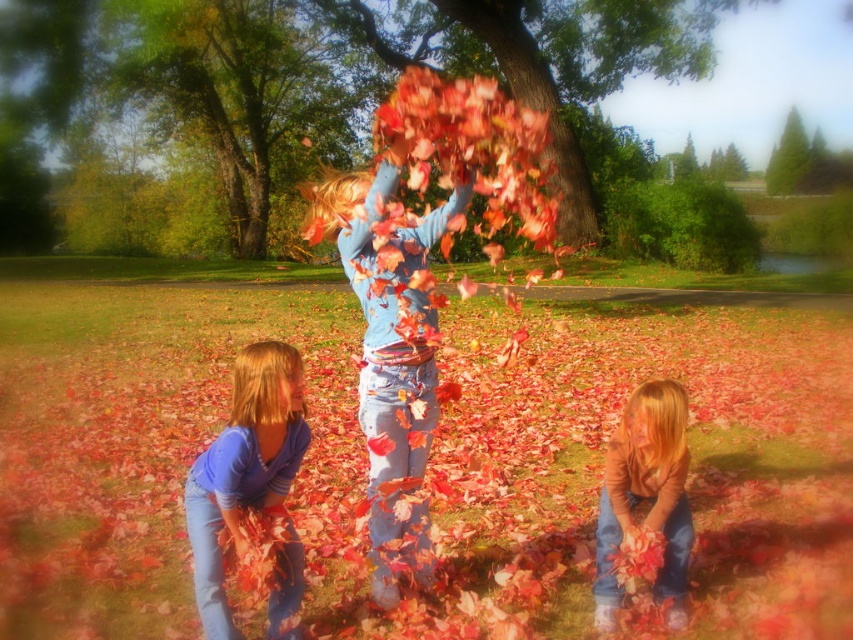
You are a photographer trying to capture the autumn scene. You want to ensure both the smooth bark tree at center and the matte brown sweater at lower right are clearly visible in your photo. Given their sizes, which object should you focus on first to ensure it doesn

The smooth bark tree at center is bigger than the matte brown sweater at lower right, so you should focus on the smooth bark tree at center first to ensure it is clearly visible before adjusting for the smaller matte brown sweater at lower right.

You are a photographer trying to capture the scene. You want to ensure both the matte blue shirt at center and the matte brown sweater at lower right are clearly visible in your shot. Since the camera can only focus on one subject at a time, which subject should you choose to ensure both are in focus?

The matte blue shirt at center is bigger than the matte brown sweater at lower right, so focusing on the matte blue shirt at center will ensure both are in focus because it is larger and likely closer to the camera.